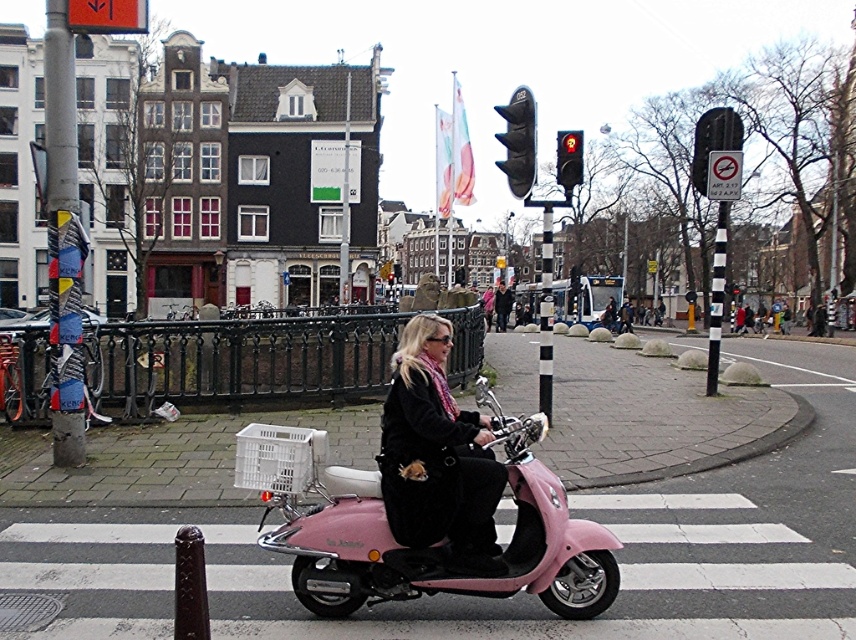
Question: Which point appears farthest from the camera in this image?

Choices:
 (A) (413, 532)
 (B) (390, 598)
 (C) (528, 163)
 (D) (571, 172)

Answer: (D)

Question: Can you confirm if velvet black coat at center is wider than red glass traffic light at upper center?

Choices:
 (A) yes
 (B) no

Answer: (B)

Question: Which object is the farthest from the black plastic traffic light at upper center?

Choices:
 (A) velvet black coat at center
 (B) red glass traffic light at upper center

Answer: (B)

Question: From the image, what is the correct spatial relationship of pink matte scooter at center in relation to black plastic traffic light at upper center?

Choices:
 (A) below
 (B) above

Answer: (A)

Question: Does pink matte scooter at center have a greater width compared to velvet black coat at center?

Choices:
 (A) yes
 (B) no

Answer: (A)

Question: Which object appears closest to the camera in this image?

Choices:
 (A) red glass traffic light at upper center
 (B) pink matte scooter at center
 (C) black plastic traffic light at upper center

Answer: (B)